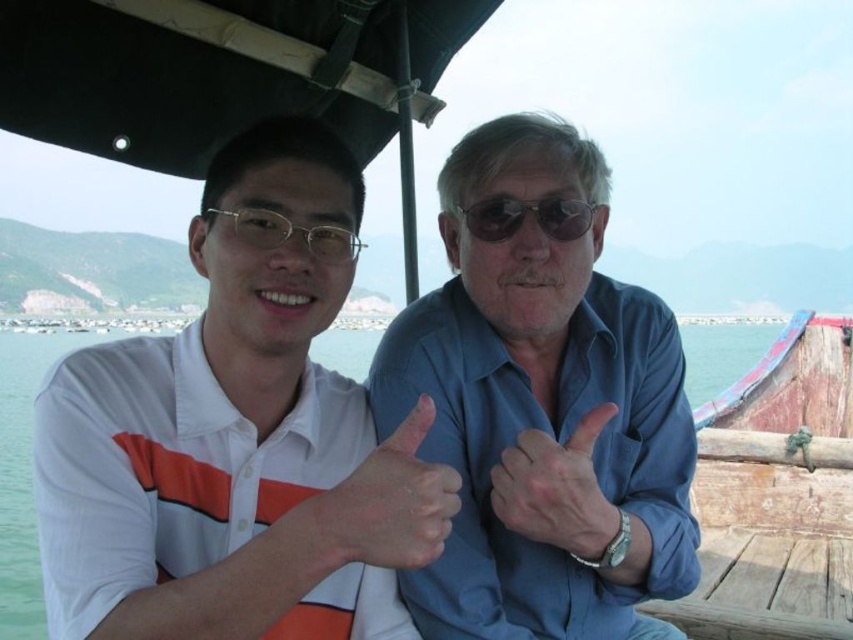
Can you confirm if blue cotton shirt at center is positioned to the right of dry skin at center?

Indeed, blue cotton shirt at center is positioned on the right side of dry skin at center.

Between blue cotton shirt at center and dry skin at center, which one is positioned lower?

dry skin at center is below.

What are the coordinates of `blue cotton shirt at center` in the screenshot? It's located at (543, 412).

Is blue cotton shirt at center thinner than smooth skin hand at center?

No, blue cotton shirt at center is not thinner than smooth skin hand at center.

Between blue cotton shirt at center and smooth skin hand at center, which one has less height?

smooth skin hand at center

I want to click on blue cotton shirt at center, so click(543, 412).

In the scene shown: Does smooth skin hand at center have a lesser height compared to sunglasses at center?

Incorrect, smooth skin hand at center's height does not fall short of sunglasses at center's.

Is point (589, 490) closer to camera compared to point (505, 198)?

Yes, it is.

Where is `smooth skin hand at center`? The image size is (853, 640). smooth skin hand at center is located at coordinates (556, 490).

Where is `smooth skin hand at center`? The height and width of the screenshot is (640, 853). smooth skin hand at center is located at coordinates (556, 490).